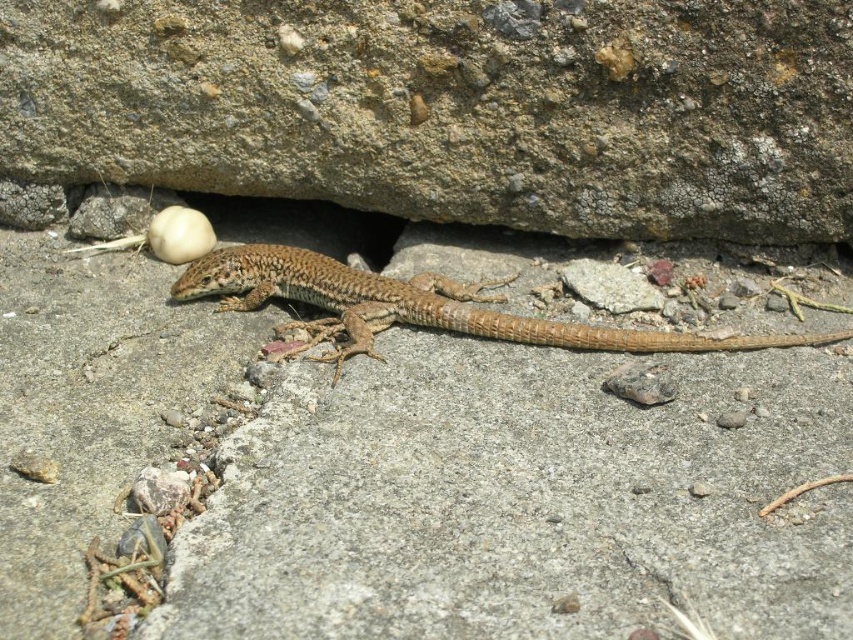
Question: Is brown rough stone at upper center positioned before brown/scaly lizard at center?

Choices:
 (A) no
 (B) yes

Answer: (B)

Question: Which object is closer to the camera taking this photo?

Choices:
 (A) brown rough stone at upper center
 (B) brown/scaly lizard at center

Answer: (A)

Question: Among these objects, which one is nearest to the camera?

Choices:
 (A) brown rough stone at upper center
 (B) brown/scaly lizard at center

Answer: (A)

Question: Does brown rough stone at upper center have a greater width compared to brown/scaly lizard at center?

Choices:
 (A) no
 (B) yes

Answer: (B)

Question: Does brown rough stone at upper center lie behind brown/scaly lizard at center?

Choices:
 (A) yes
 (B) no

Answer: (B)